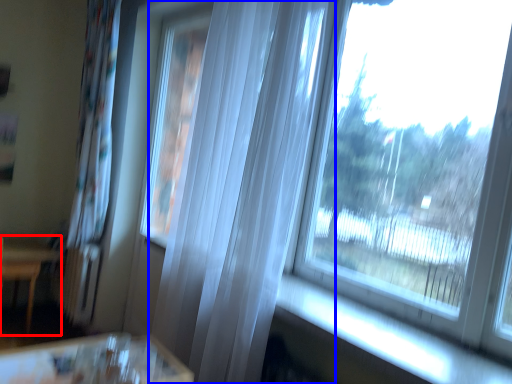
Question: Which object is further to the camera taking this photo, furniture (highlighted by a red box) or curtain (highlighted by a blue box)?

Choices:
 (A) furniture
 (B) curtain

Answer: (A)